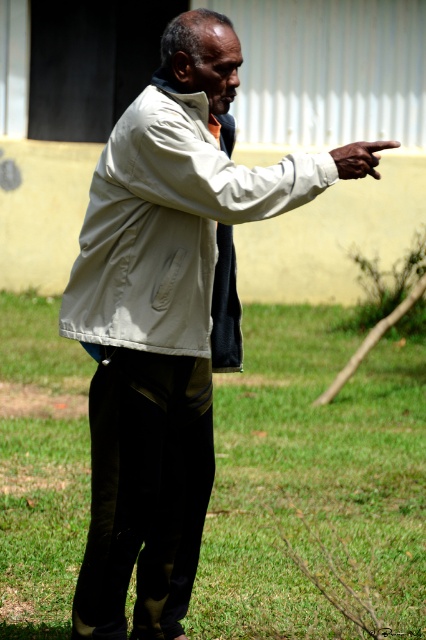
At what (x,y) coordinates should I click in order to perform the action: click on light beige fabric jacket at center. Please return your answer as a coordinate pair (x, y). The image size is (426, 640). Looking at the image, I should click on (172, 230).

Which is below, light beige fabric jacket at center or white matte hand at upper right?

light beige fabric jacket at center

Between point (163, 148) and point (353, 145), which one is positioned behind?

Point (353, 145)

Find the location of a particular element. The width and height of the screenshot is (426, 640). light beige fabric jacket at center is located at coordinates (172, 230).

Does green grass at center appear on the left side of light beige fabric jacket at center?

Correct, you'll find green grass at center to the left of light beige fabric jacket at center.

Does point (259, 448) lie in front of point (92, 291)?

No, it is not.

I want to click on green grass at center, so tap(313, 484).

From the picture: Does green grass at center have a greater width compared to white matte hand at upper right?

Incorrect, green grass at center's width does not surpass white matte hand at upper right's.

From the picture: Is green grass at center positioned at the back of white matte hand at upper right?

Yes, it is.

Which is in front, point (11, 387) or point (345, 176)?

Positioned in front is point (345, 176).

At what (x,y) coordinates should I click in order to perform the action: click on green grass at center. Please return your answer as a coordinate pair (x, y). This screenshot has height=640, width=426. Looking at the image, I should click on (313, 484).